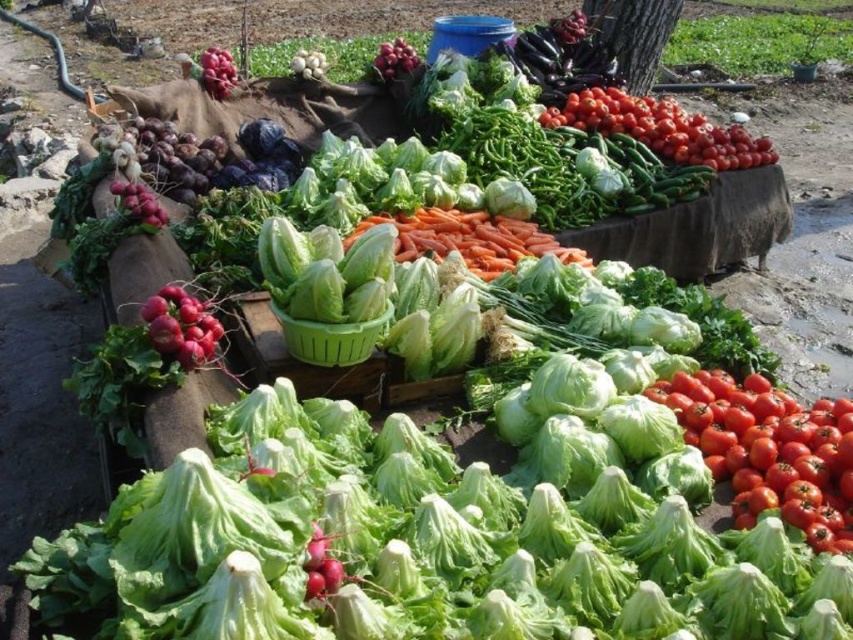
Question: Is red matte tomatoes at upper right wider than shiny purple grapes at upper left?

Choices:
 (A) yes
 (B) no

Answer: (A)

Question: In this image, where is red matte tomatoes at upper right located relative to matte red onion at upper center?

Choices:
 (A) above
 (B) below

Answer: (B)

Question: Which is farther from the orange smooth carrots at center?

Choices:
 (A) matte red onion at upper center
 (B) red matte tomatoes at upper right

Answer: (A)

Question: Which of the following is the closest to the observer?

Choices:
 (A) shiny purple grapes at upper left
 (B) matte red onion at upper center

Answer: (A)

Question: Which point is farther to the camera?

Choices:
 (A) orange smooth carrots at center
 (B) red matte tomatoes at upper right
 (C) shiny purple grapes at upper left
 (D) matte red onion at upper center

Answer: (D)

Question: Where is red matte tomatoes at lower right located in relation to red matte tomatoes at upper right in the image?

Choices:
 (A) left
 (B) right

Answer: (A)